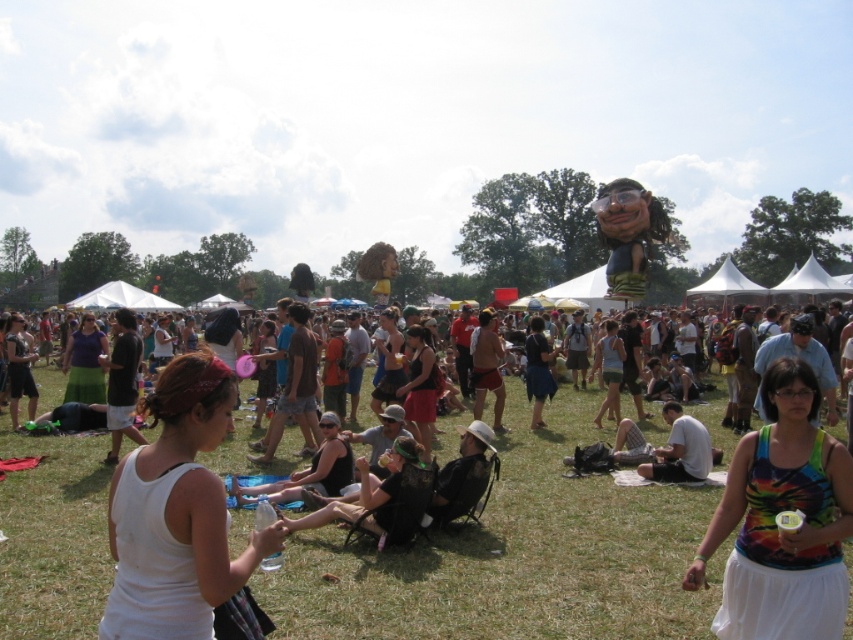
Question: Which point is farther from the camera taking this photo?

Choices:
 (A) (759, 496)
 (B) (106, 348)
 (C) (222, 500)
 (D) (424, 364)

Answer: (B)

Question: From the image, what is the correct spatial relationship of white tank top at center in relation to matte purple blouse at center?

Choices:
 (A) left
 (B) right

Answer: (B)

Question: Considering the real-world distances, which object is farthest from the white tank top at center?

Choices:
 (A) matte purple blouse at center
 (B) matte black tank top at center
 (C) white cotton tank top at center

Answer: (A)

Question: Does white cotton tank top at center appear under matte black tank top at center?

Choices:
 (A) no
 (B) yes

Answer: (A)

Question: Can you confirm if white cotton tank top at center is positioned to the left of matte black tank top at center?

Choices:
 (A) no
 (B) yes

Answer: (A)

Question: Among these objects, which one is farthest from the camera?

Choices:
 (A) matte purple blouse at center
 (B) white tank top at center
 (C) matte black tank top at center

Answer: (A)